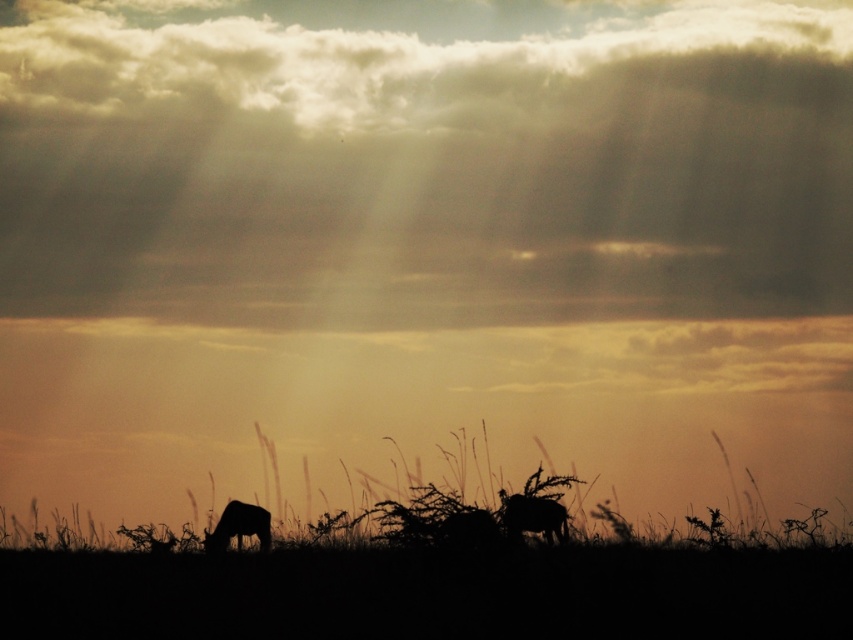
You are standing in the landscape scene described. There is a point marked at coordinates (532, 516). What does this point indicate?

The point at (532, 516) marks the silhouette fur at center.

You are an observer standing in the landscape scene. You notice the cloudy sky at upper center and the silhouette elephant at lower left. Which object is located higher in the image?

The cloudy sky at upper center is positioned over the silhouette elephant at lower left, so it is higher in the image.